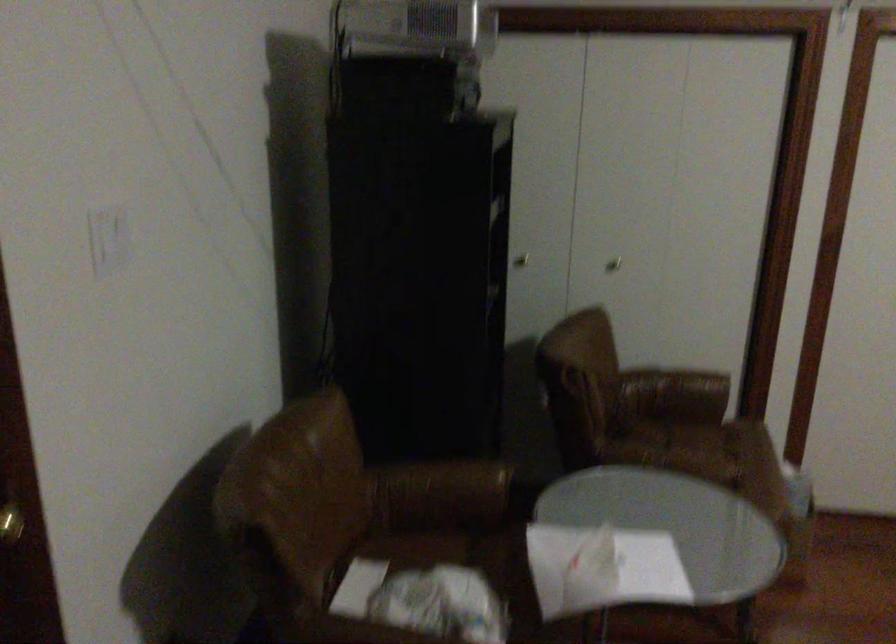
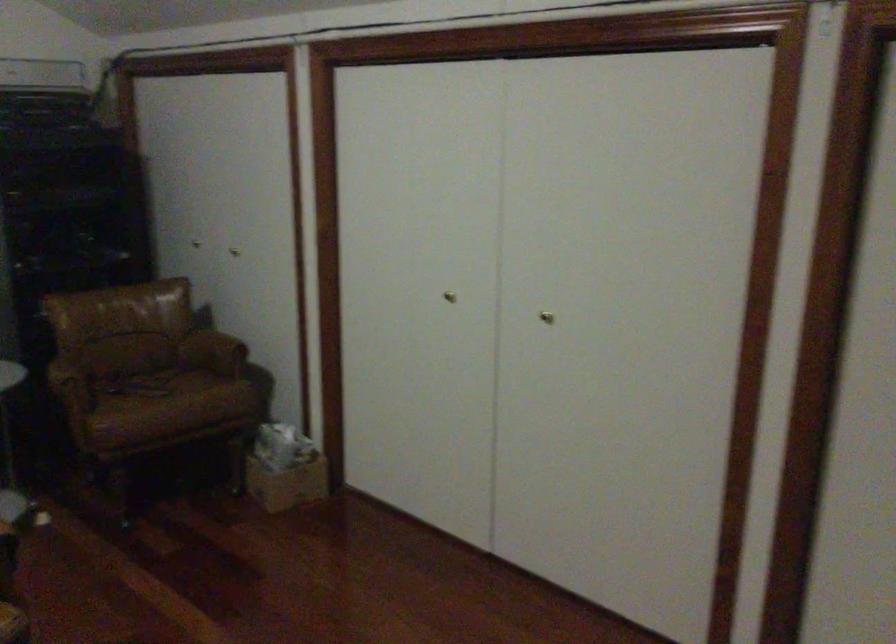
Find the pixel in the second image that matches (803,522) in the first image.

(287, 484)